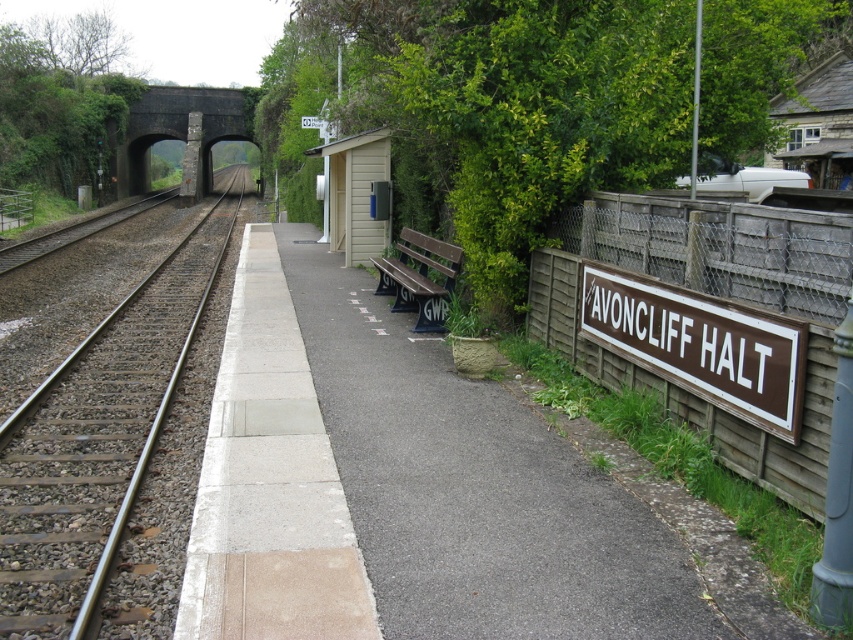
You are a railway inspector checking the alignment of the tracks and signs. Based on the scene, can you confirm if the smooth metal tracks at center are positioned above the brown wooden sign at right?

Yes, the smooth metal tracks at center are located above the brown wooden sign at right according to the description.

You are standing on the platform at AVONCLIFF HALT and want to take a photo of both point (65,444) and point (386,289) in the scene. Since you want both points to be in focus, which point should you focus on to ensure both are sharp?

You should focus on point (386,289) because it is farther away from the camera than point (65,444). By focusing on the farther point, the near point will also be within the depth of field, ensuring both are sharp.